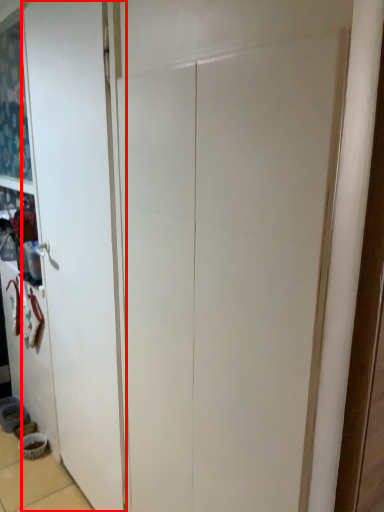
Question: Observing the image, what is the correct spatial positioning of door (annotated by the red box) in reference to bowl?

Choices:
 (A) right
 (B) left

Answer: (A)